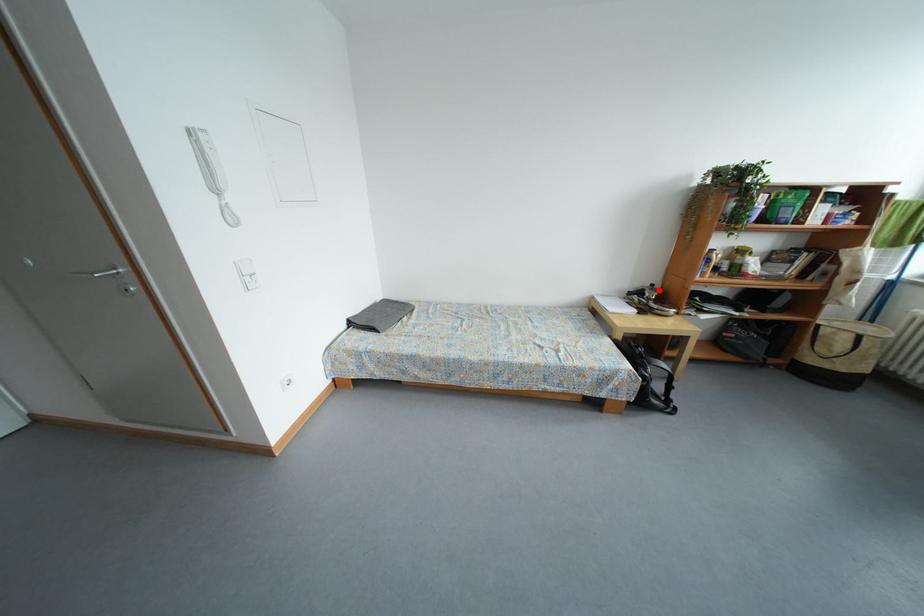
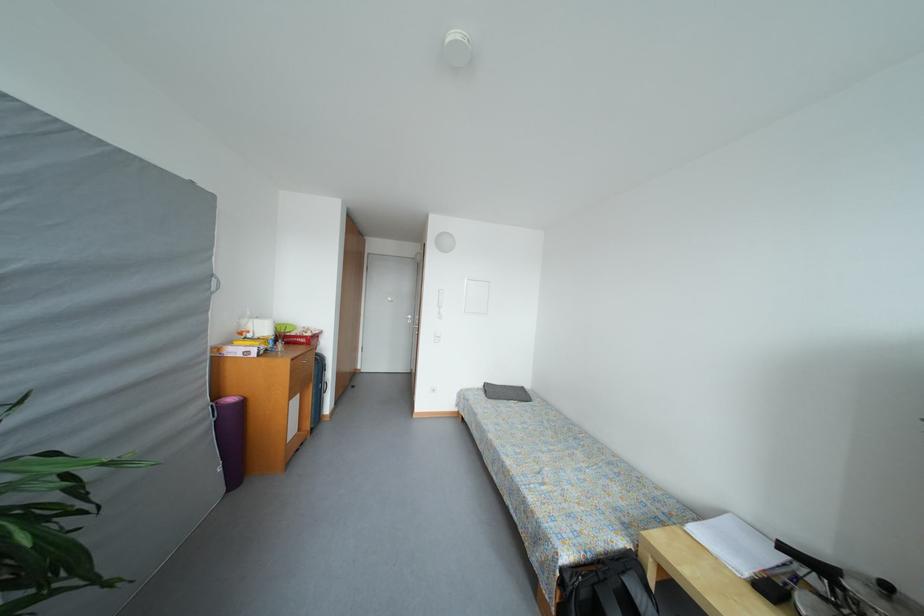
In the second image, find the point that corresponds to the highlighted location in the first image.

(893, 591)